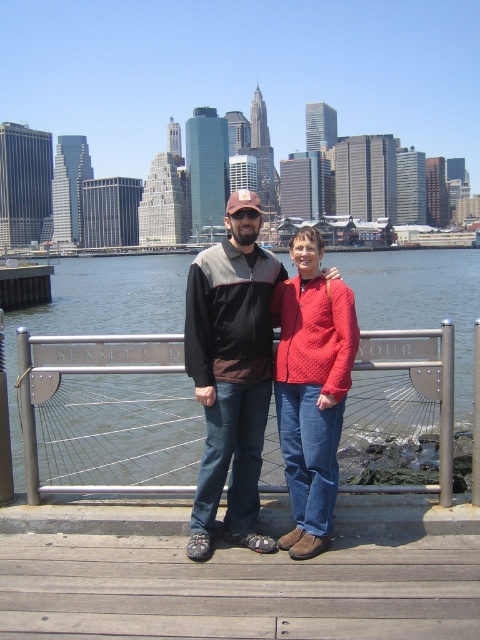
Question: Which point is closer to the camera?

Choices:
 (A) (34, 332)
 (B) (259, 328)
 (C) (309, 403)
 (D) (203, 608)

Answer: (D)

Question: Does wooden at lower center appear over quilted red sweater at center?

Choices:
 (A) yes
 (B) no

Answer: (B)

Question: Which point is farther from the camera taking this photo?

Choices:
 (A) (269, 321)
 (B) (319, 499)
 (C) (395, 584)
 (D) (437, 310)

Answer: (D)

Question: Which of the following is the closest to the observer?

Choices:
 (A) wooden at lower center
 (B) matte black jacket at center
 (C) quilted red sweater at center
 (D) clear water at center

Answer: (A)

Question: Does clear water at center appear under matte black jacket at center?

Choices:
 (A) yes
 (B) no

Answer: (B)

Question: Does wooden at lower center appear on the right side of clear water at center?

Choices:
 (A) yes
 (B) no

Answer: (A)